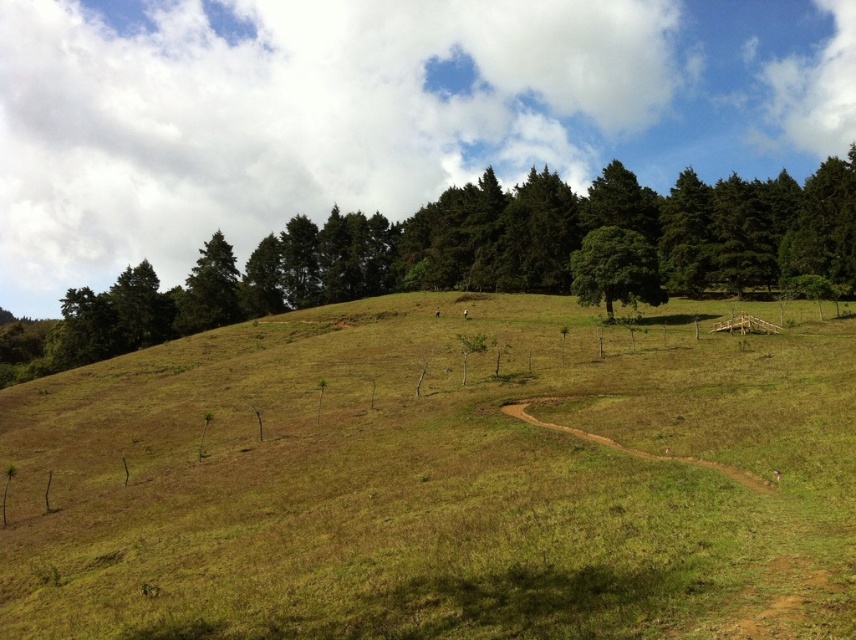
Is green grassy hillside at center below green leafy tree at center?

Correct, green grassy hillside at center is located below green leafy tree at center.

Identify the location of green grassy hillside at center. This screenshot has width=856, height=640. (437, 480).

This screenshot has height=640, width=856. Describe the element at coordinates (437, 480) in the screenshot. I see `green grassy hillside at center` at that location.

Is point (3, 605) behind point (637, 211)?

No, it is in front of (637, 211).

The width and height of the screenshot is (856, 640). I want to click on green grassy hillside at center, so click(x=437, y=480).

Is green leafy tree at center thinner than brown dirt trail at center?

Incorrect, green leafy tree at center's width is not less than brown dirt trail at center's.

Can you confirm if green leafy tree at center is positioned below brown dirt trail at center?

No.

Where is `green leafy tree at center`? Image resolution: width=856 pixels, height=640 pixels. green leafy tree at center is located at coordinates (615, 269).